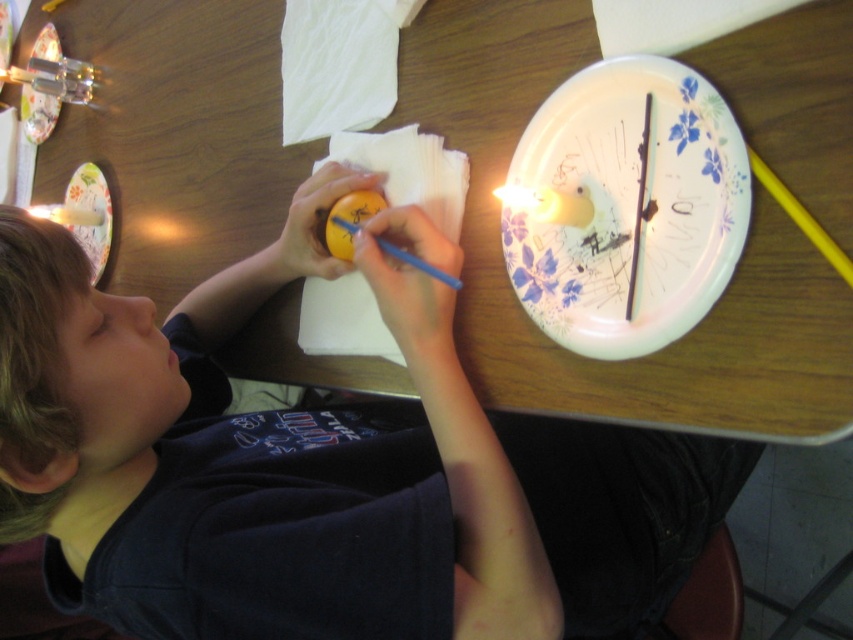
Is smooth yellow egg at center closer to the viewer compared to floral paper plate at upper right?

Yes, smooth yellow egg at center is closer to the viewer.

Which is above, smooth yellow egg at center or floral paper plate at upper right?

Positioned higher is floral paper plate at upper right.

Between point (350, 512) and point (596, 141), which one is positioned in front?

Positioned in front is point (350, 512).

Where is `smooth yellow egg at center`? Image resolution: width=853 pixels, height=640 pixels. smooth yellow egg at center is located at coordinates (320, 465).

Is point (529, 38) behind point (334, 221)?

No, it is in front of (334, 221).

Measure the distance between wooden table at center and camera.

wooden table at center and camera are 20.07 inches apart from each other.

Where is `wooden table at center`? This screenshot has width=853, height=640. wooden table at center is located at coordinates (663, 348).

Between point (503, 268) and point (645, 339), which one is positioned behind?

The point (503, 268) is more distant.

Which of these two, wooden table at center or floral paper plate at upper right, stands taller?

With more height is wooden table at center.

Who is more forward, (795,228) or (515,196)?

Point (795,228)

The height and width of the screenshot is (640, 853). Find the location of `wooden table at center`. wooden table at center is located at coordinates (663, 348).